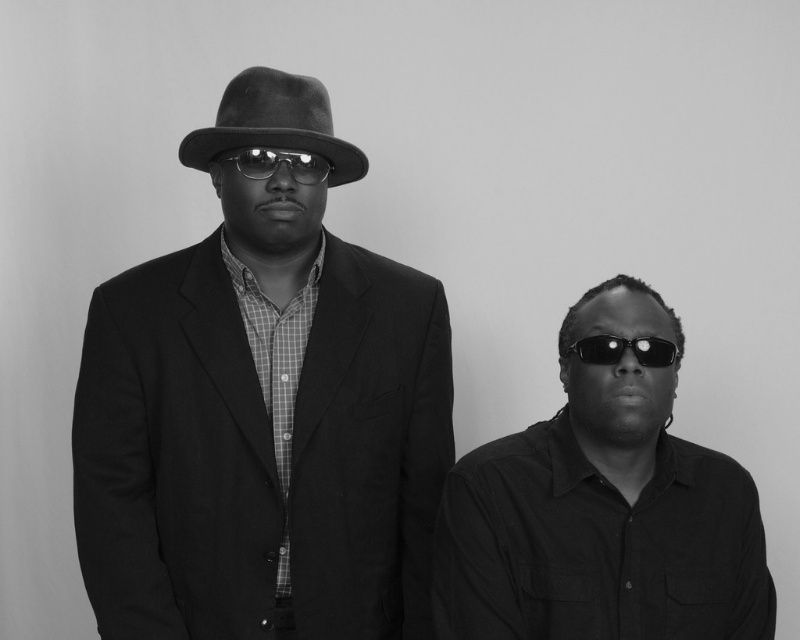
Question: Which object appears closest to the camera in this image?

Choices:
 (A) felt fedora at center
 (B) black reflective sunglasses at right
 (C) matte black goggles at center
 (D) matte black shirt at right

Answer: (D)

Question: Among these objects, which one is nearest to the camera?

Choices:
 (A) matte black hat at center
 (B) matte black shirt at right

Answer: (B)

Question: Does felt fedora at center appear on the right side of black reflective sunglasses at right?

Choices:
 (A) yes
 (B) no

Answer: (B)

Question: Can you confirm if matte black hat at center is thinner than matte black shirt at right?

Choices:
 (A) no
 (B) yes

Answer: (A)

Question: Which point is closer to the camera?

Choices:
 (A) matte black hat at center
 (B) matte black shirt at right
 (C) matte black goggles at center
 (D) felt fedora at center

Answer: (B)

Question: Is matte black hat at center to the left of black reflective sunglasses at right from the viewer's perspective?

Choices:
 (A) yes
 (B) no

Answer: (A)